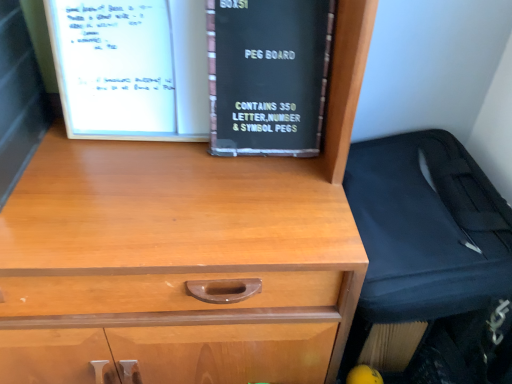
This screenshot has width=512, height=384. I want to click on black cardboard box at center, so click(x=268, y=75).

The width and height of the screenshot is (512, 384). What do you see at coordinates (268, 75) in the screenshot?
I see `black cardboard box at center` at bounding box center [268, 75].

Identify the location of black fabric suitcase at right. The width and height of the screenshot is (512, 384). (432, 257).

Measure the distance between black fabric suitcase at right and camera.

28.24 inches.

What do you see at coordinates (432, 257) in the screenshot? I see `black fabric suitcase at right` at bounding box center [432, 257].

The image size is (512, 384). Identify the location of black cardboard box at center. (268, 75).

Which object is positioned more to the right, black fabric suitcase at right or black cardboard box at center?

black fabric suitcase at right.

Is black fabric suitcase at right positioned in front of black cardboard box at center?

Yes, it is in front of black cardboard box at center.

Is point (362, 188) closer to camera compared to point (213, 130)?

No, (362, 188) is behind (213, 130).

From the image's perspective, between black fabric suitcase at right and black cardboard box at center, who is located below?

black fabric suitcase at right is shown below in the image.

From a real-world perspective, is black fabric suitcase at right above or below black cardboard box at center?

From a real-world perspective, black fabric suitcase at right is physically below black cardboard box at center.

In terms of width, does black fabric suitcase at right look wider or thinner when compared to black cardboard box at center?

Considering their sizes, black fabric suitcase at right looks broader than black cardboard box at center.

From the picture: Who is shorter, black fabric suitcase at right or black cardboard box at center?

Standing shorter between the two is black cardboard box at center.

Considering the relative sizes of black fabric suitcase at right and black cardboard box at center in the image provided, is black fabric suitcase at right bigger than black cardboard box at center?

Correct, black fabric suitcase at right is larger in size than black cardboard box at center.

Is black cardboard box at center located within black fabric suitcase at right?

No, black cardboard box at center is not a part of black fabric suitcase at right.

Is black fabric suitcase at right next to black cardboard box at center and touching it?

There is a gap between black fabric suitcase at right and black cardboard box at center.

Could you tell me if black fabric suitcase at right is facing black cardboard box at center?

No, black fabric suitcase at right is not oriented towards black cardboard box at center.

From the picture: How different are the orientations of black fabric suitcase at right and black cardboard box at center in degrees?

The angle between the facing direction of black fabric suitcase at right and the facing direction of black cardboard box at center is 1.09 degrees.

How distant is black fabric suitcase at right from black cardboard box at center?

They are 12.45 inches apart.

The width and height of the screenshot is (512, 384). I want to click on luggage below the black cardboard box at center (from a real-world perspective), so click(432, 257).

Does black cardboard box at center appear on the left side of black fabric suitcase at right?

Yes, black cardboard box at center is to the left of black fabric suitcase at right.

Is the depth of black cardboard box at center less than that of black fabric suitcase at right?

No, it is behind black fabric suitcase at right.

Is point (307, 138) positioned behind point (443, 219)?

Yes, it is behind point (443, 219).

From the image's perspective, which one is positioned lower, black cardboard box at center or black fabric suitcase at right?

black fabric suitcase at right.

From a real-world perspective, is black cardboard box at center beneath black fabric suitcase at right?

No.

Considering the relative sizes of black cardboard box at center and black fabric suitcase at right in the image provided, is black cardboard box at center wider than black fabric suitcase at right?

In fact, black cardboard box at center might be narrower than black fabric suitcase at right.

From their relative heights in the image, would you say black cardboard box at center is taller or shorter than black fabric suitcase at right?

black cardboard box at center is shorter than black fabric suitcase at right.

Does black cardboard box at center have a larger size compared to black fabric suitcase at right?

Incorrect, black cardboard box at center is not larger than black fabric suitcase at right.

Would you say black fabric suitcase at right is part of black cardboard box at center's contents?

Actually, black fabric suitcase at right is outside black cardboard box at center.

Is black cardboard box at center placed right next to black fabric suitcase at right?

No, black cardboard box at center is not beside black fabric suitcase at right.

Is black cardboard box at center aimed at black fabric suitcase at right?

No, black cardboard box at center is not aimed at black fabric suitcase at right.

Can you tell me how much black cardboard box at center and black fabric suitcase at right differ in facing direction?

The angular difference between black cardboard box at center and black fabric suitcase at right is 1.09 degrees.

I want to click on luggage on the right of black cardboard box at center, so click(432, 257).

Image resolution: width=512 pixels, height=384 pixels. I want to click on book above the black fabric suitcase at right (from a real-world perspective), so click(268, 75).

What are the coordinates of `luggage in front of the black cardboard box at center` in the screenshot? It's located at (432, 257).